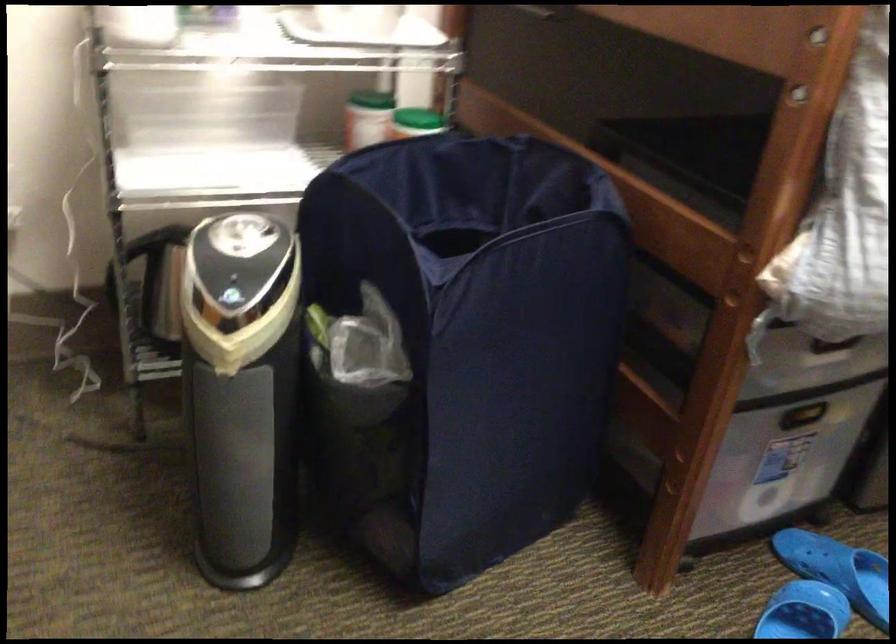
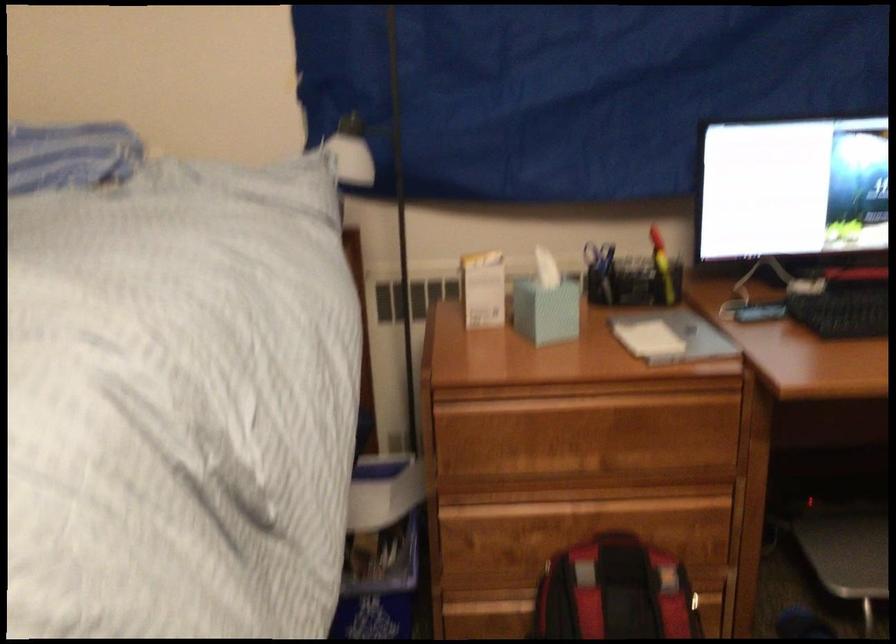
Question: The images are taken continuously from a first-person perspective. In which direction is your viewpoint rotating?

Choices:
 (A) Left
 (B) Right
 (C) Up
 (D) Down

Answer: (B)